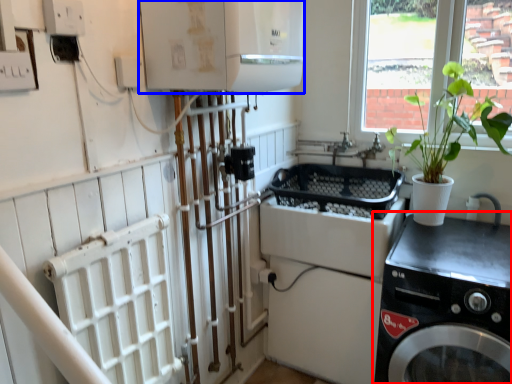
Question: Among these objects, which one is farthest to the camera, washing machine (highlighted by a red box) or appliance (highlighted by a blue box)?

Choices:
 (A) washing machine
 (B) appliance

Answer: (A)